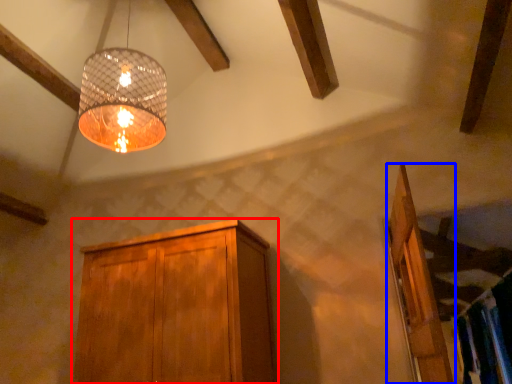
Question: Which object is further to the camera taking this photo, cabinetry (highlighted by a red box) or door (highlighted by a blue box)?

Choices:
 (A) cabinetry
 (B) door

Answer: (A)